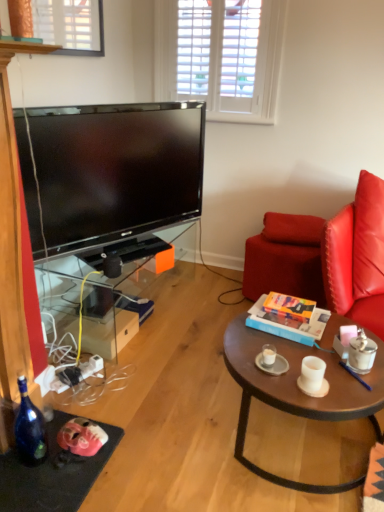
Locate an element on the screen. vacant space in front of matte gray saucer at center is located at coordinates (288, 391).